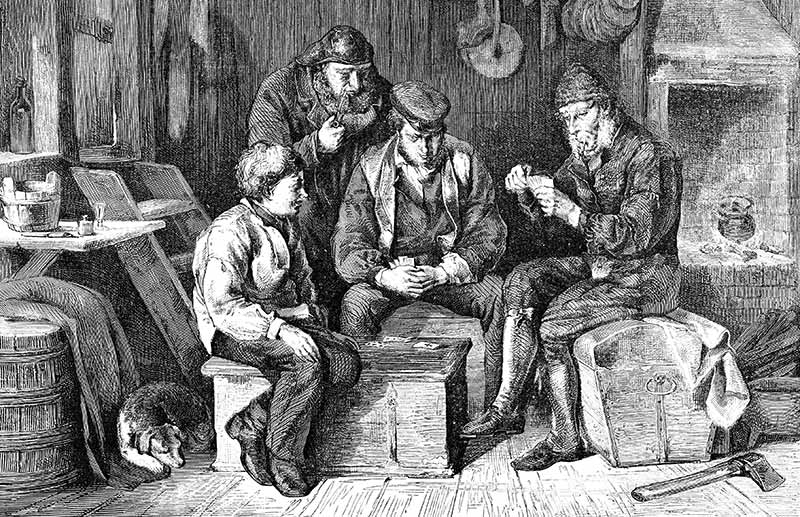
At what (x,y) coordinates should I click in order to perform the action: click on table. Please return your answer as a coordinate pair (x, y). The width and height of the screenshot is (800, 517). Looking at the image, I should click on (70, 244).